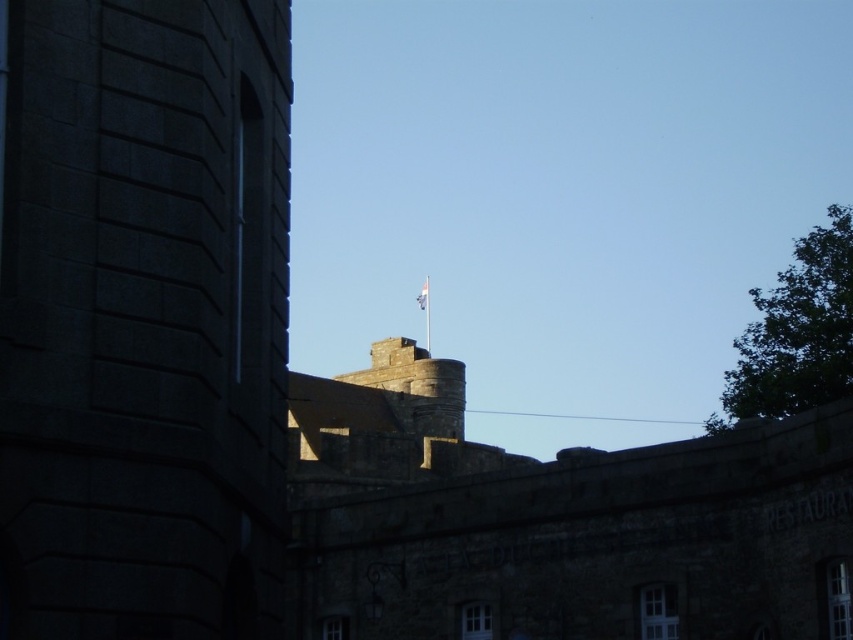
You are a tourist standing in front of the historic stone building. You notice the dark stone tower at left and the white fabric flag at upper center. Which object is positioned higher in the image?

The white fabric flag at upper center is positioned higher than the dark stone tower at left.

You are a tourist standing in front of the historic stone building. You notice the dark stone tower at left and the white fabric flag at upper center. Which object is larger in size?

The dark stone tower at left is bigger than the white fabric flag at upper center.

You are a drone operator tasked with flying a drone from the dark stone tower at left to the white fabric flag at upper center. The drone has a maximum range of 200 meters. Can the drone reach the flag without running out of battery?

The dark stone tower at left and white fabric flag at upper center are 205.97 meters apart from each other. Since the drone has a maximum range of 200 meters, it cannot reach the flag without running out of battery.